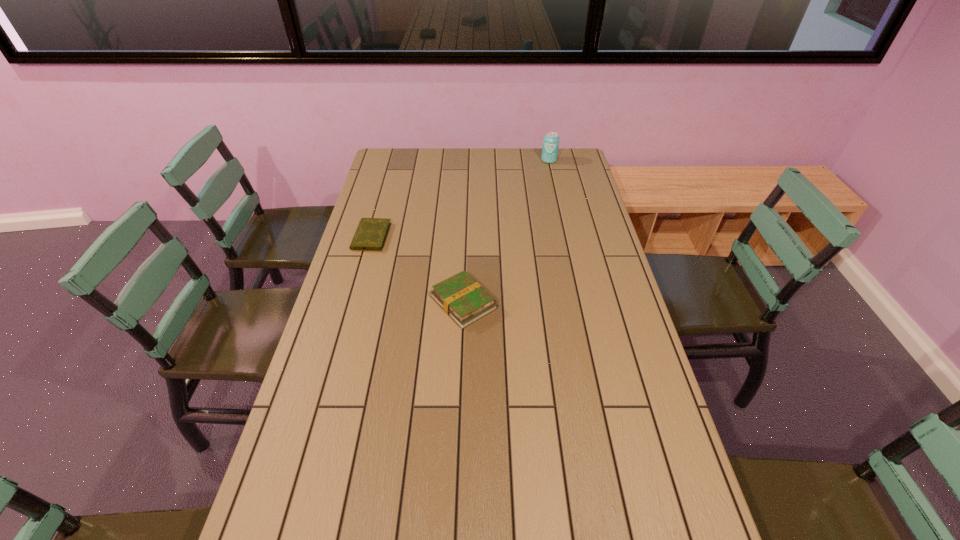
You are a GUI agent. You are given a task and a screenshot of the screen. Output one action in this format:
    pyautogui.click(x=<x>, y=<y>)
    Task: Click on the closest object to the book
    
    Given the screenshot: What is the action you would take?
    pyautogui.click(x=371, y=233)

The width and height of the screenshot is (960, 540). What are the coordinates of `object that stands as the second closest to the second object from right to left` in the screenshot? It's located at (550, 147).

Locate an element on the screen. The width and height of the screenshot is (960, 540). blank space that satisfies the following two spatial constraints: 1. on the back side of the second tallest object; 2. on the left side of the rightmost object is located at coordinates (468, 160).